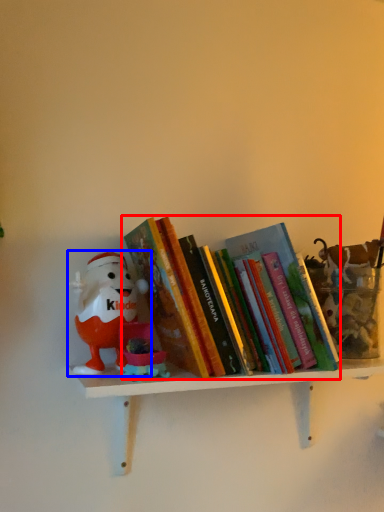
Question: Which object is further to the camera taking this photo, book (highlighted by a red box) or toy (highlighted by a blue box)?

Choices:
 (A) book
 (B) toy

Answer: (B)